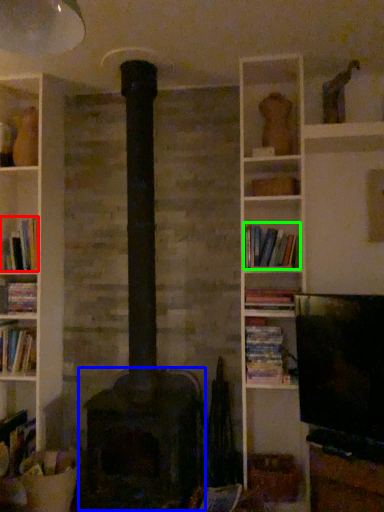
Question: Based on their relative distances, which object is farther from book (highlighted by a red box)? Choose from stove (highlighted by a blue box) and book (highlighted by a green box).

Choices:
 (A) stove
 (B) book

Answer: (B)